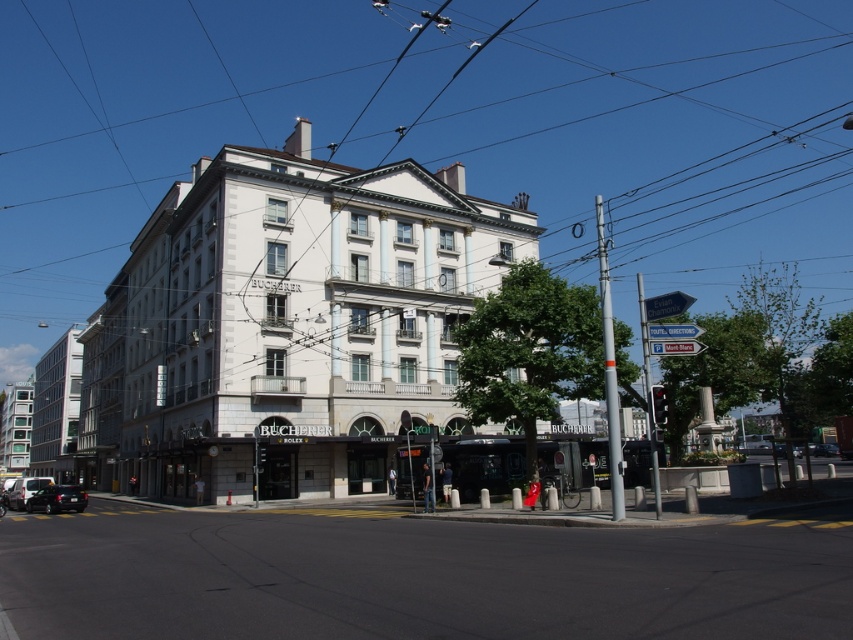
Can you confirm if black asphalt road at lower center is bigger than shiny black car at lower left?

No, black asphalt road at lower center is not bigger than shiny black car at lower left.

In the scene shown: Is black asphalt road at lower center smaller than shiny black car at lower left?

Yes.

Is point (695, 547) positioned after point (45, 502)?

No, it is not.

Find the location of a particular element. The height and width of the screenshot is (640, 853). black asphalt road at lower center is located at coordinates (418, 577).